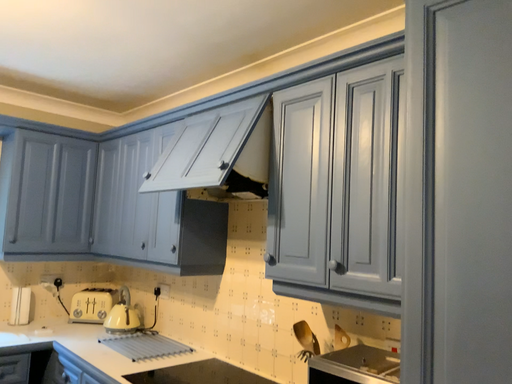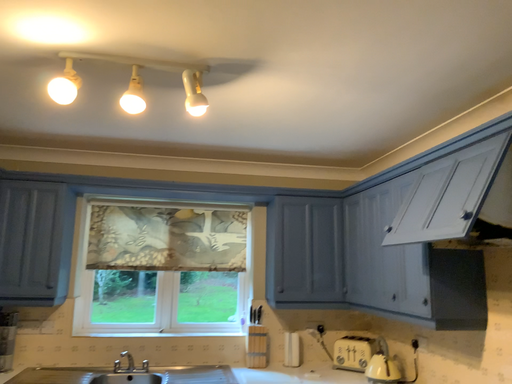
Question: How did the camera likely rotate when shooting the video?

Choices:
 (A) rotated left
 (B) rotated right

Answer: (A)